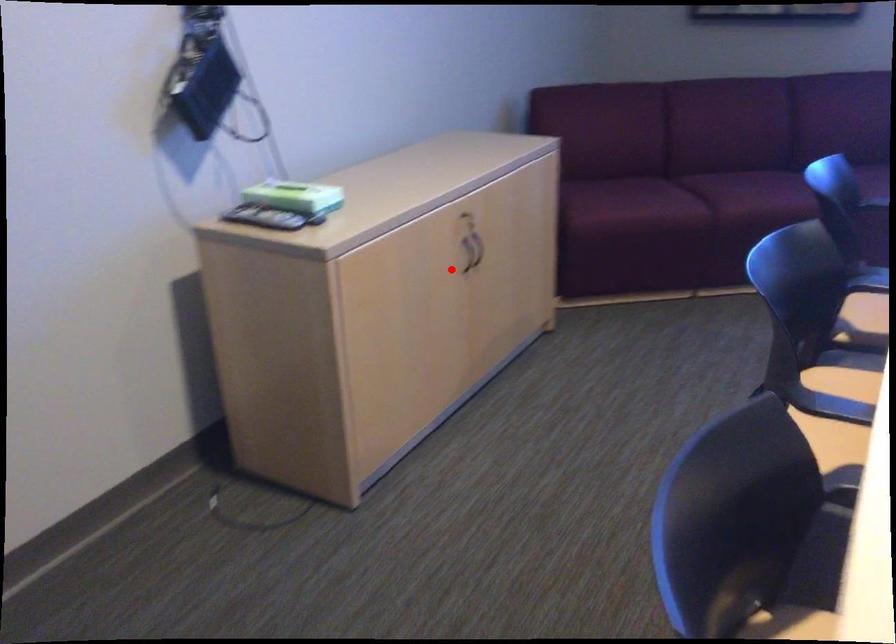
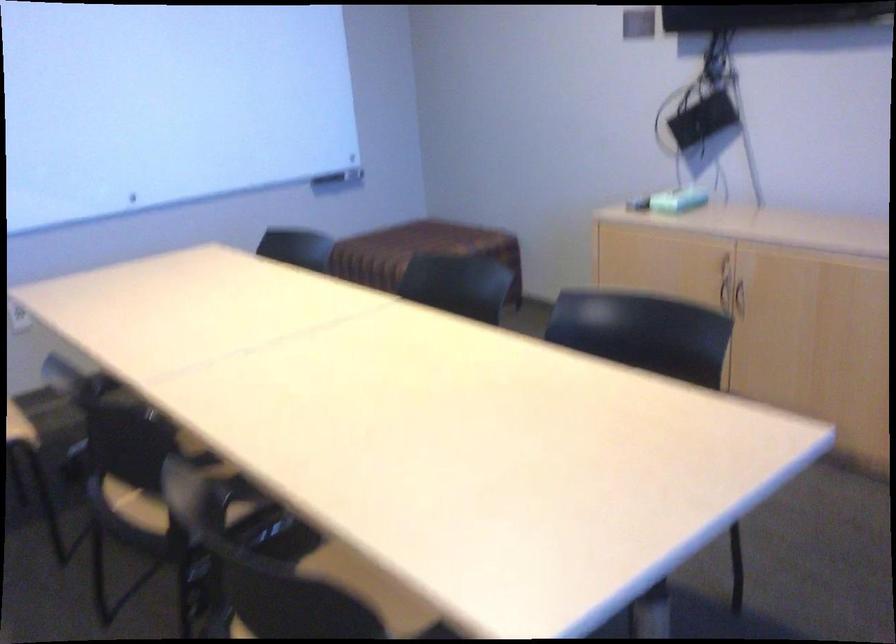
Locate, in the second image, the point that corresponds to the highlighted location in the first image.

(725, 295)